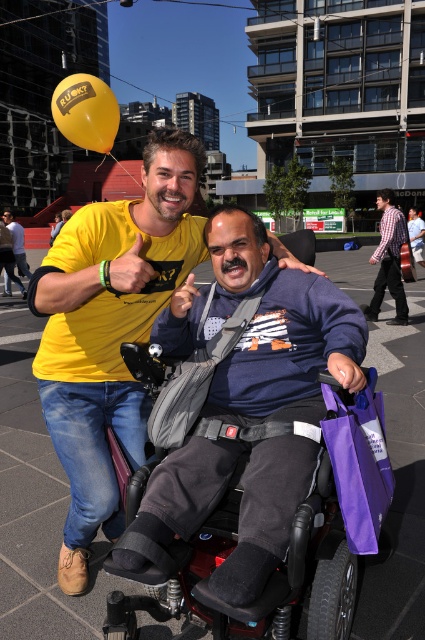
Question: Is red plastic wheelchair at center thinner than purple fabric bag at lower right?

Choices:
 (A) yes
 (B) no

Answer: (B)

Question: Is plaid cotton shirt at center positioned behind blue denim jeans at center?

Choices:
 (A) yes
 (B) no

Answer: (B)

Question: Among these objects, which one is farthest from the camera?

Choices:
 (A) blue denim jeans at center
 (B) yellow t-shirt at left

Answer: (A)

Question: Among these objects, which one is farthest from the camera?

Choices:
 (A) matte yellow t-shirt at upper left
 (B) yellow rubber balloon at upper left
 (C) purple fabric bag at lower right

Answer: (B)

Question: Is purple fabric bag at lower right above plaid cotton shirt at center?

Choices:
 (A) yes
 (B) no

Answer: (B)

Question: Which point appears farthest from the camera in this image?

Choices:
 (A) (22, 272)
 (B) (56, 220)
 (C) (377, 452)

Answer: (B)